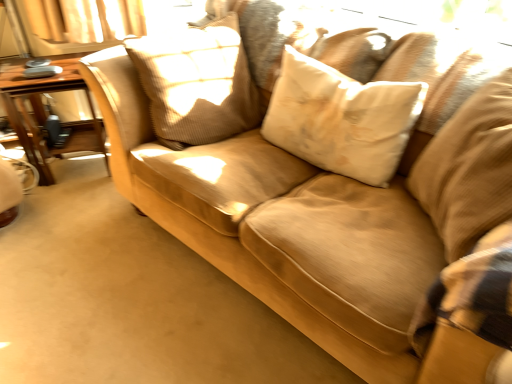
Question: Considering the relative positions of beige fabric pillow at right, which appears as the third pillow when viewed from the left, and wooden table at left in the image provided, is beige fabric pillow at right, which appears as the third pillow when viewed from the left, to the left of wooden table at left from the viewer's perspective?

Choices:
 (A) no
 (B) yes

Answer: (A)

Question: Is wooden table at left completely or partially inside beige fabric pillow at right, which is counted as the first pillow, starting from the right?

Choices:
 (A) no
 (B) yes

Answer: (A)

Question: Is beige fabric pillow at right, which appears as the third pillow when viewed from the left, oriented away from wooden table at left?

Choices:
 (A) yes
 (B) no

Answer: (B)

Question: Does beige fabric pillow at right, which appears as the third pillow when viewed from the left, have a larger size compared to wooden table at left?

Choices:
 (A) no
 (B) yes

Answer: (B)

Question: Is beige fabric pillow at right, which is counted as the first pillow, starting from the right, outside wooden table at left?

Choices:
 (A) no
 (B) yes

Answer: (B)

Question: From a real-world perspective, relative to white soft pillow at center, arranged as the 2th pillow when viewed from the left, is wooden table at left vertically above or below?

Choices:
 (A) below
 (B) above

Answer: (A)

Question: Is wooden table at left taller or shorter than white soft pillow at center, arranged as the 2th pillow when viewed from the left?

Choices:
 (A) tall
 (B) short

Answer: (A)

Question: Based on their sizes in the image, would you say wooden table at left is bigger or smaller than white soft pillow at center, arranged as the 2th pillow when viewed from the left?

Choices:
 (A) small
 (B) big

Answer: (B)

Question: Choose the correct answer: Is wooden table at left inside white soft pillow at center, arranged as the 2th pillow when viewed from the left, or outside it?

Choices:
 (A) outside
 (B) inside

Answer: (A)

Question: Visually, is white soft pillow at center, arranged as the 2th pillow when viewed from the right, positioned to the left or to the right of wooden table at left?

Choices:
 (A) left
 (B) right

Answer: (B)

Question: From a real-world perspective, is white soft pillow at center, arranged as the 2th pillow when viewed from the right, positioned above or below wooden table at left?

Choices:
 (A) above
 (B) below

Answer: (A)

Question: Is white soft pillow at center, arranged as the 2th pillow when viewed from the left, in front of or behind wooden table at left in the image?

Choices:
 (A) front
 (B) behind

Answer: (A)

Question: In terms of height, does white soft pillow at center, arranged as the 2th pillow when viewed from the right, look taller or shorter compared to wooden table at left?

Choices:
 (A) tall
 (B) short

Answer: (B)

Question: Which is correct: beige textured pillow at center, the third pillow from the right, is inside wooden table at left, or outside of it?

Choices:
 (A) outside
 (B) inside

Answer: (A)

Question: Is point (172, 100) positioned closer to the camera than point (80, 54)?

Choices:
 (A) farther
 (B) closer

Answer: (B)